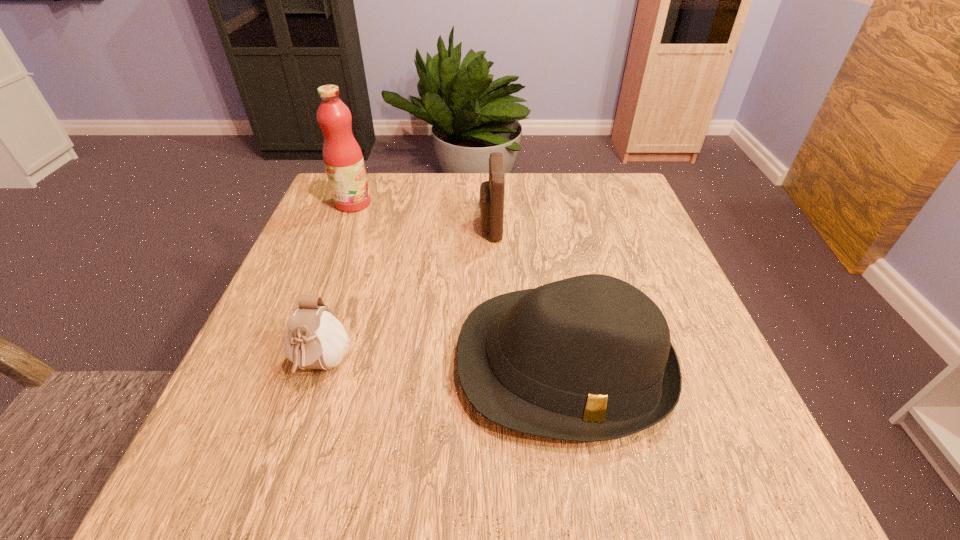
The width and height of the screenshot is (960, 540). I want to click on vacant area situated on the front-facing side of the left pouch, so click(x=288, y=470).

Find the location of a particular element. fruit juice located in the far edge section of the desktop is located at coordinates (342, 156).

The width and height of the screenshot is (960, 540). I want to click on pouch at the far edge, so click(x=491, y=202).

Locate an element on the screen. Image resolution: width=960 pixels, height=540 pixels. object present at the near edge is located at coordinates (589, 358).

Find the location of `fruit juice that is positioned at the left edge`. fruit juice that is positioned at the left edge is located at coordinates (342, 156).

Identify the location of pouch at the left edge. This screenshot has height=540, width=960. (315, 339).

Where is `object that is at the right edge`? object that is at the right edge is located at coordinates (589, 358).

This screenshot has height=540, width=960. I want to click on object present at the far left corner, so click(x=342, y=156).

This screenshot has height=540, width=960. What are the coordinates of `object situated at the near right corner` in the screenshot? It's located at (589, 358).

The image size is (960, 540). I want to click on vacant space at the far edge of the desktop, so click(x=532, y=205).